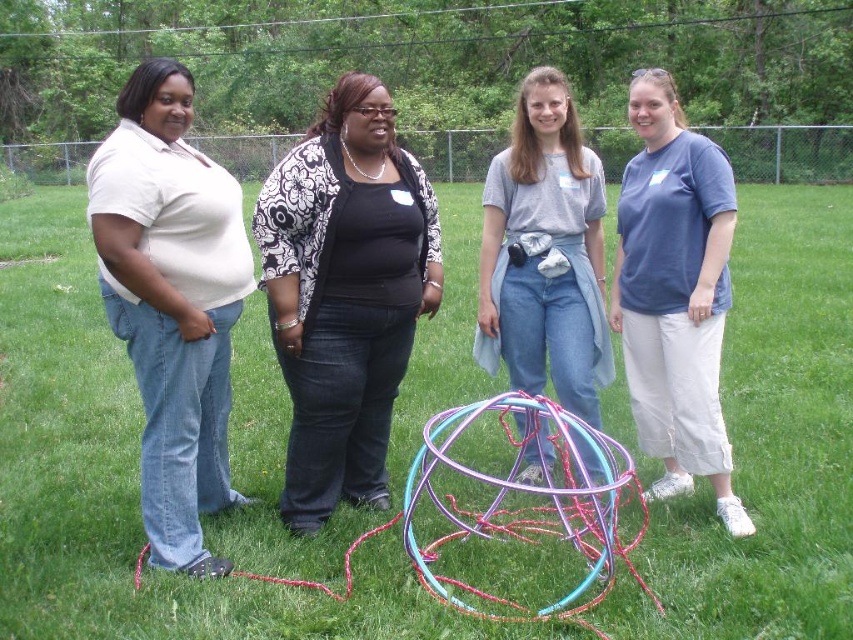
Question: Among these objects, which one is nearest to the camera?

Choices:
 (A) black matte/black textured shirt at center
 (B) blue cotton shirt at right

Answer: (A)

Question: Is blue cotton shirt at right in front of gray cotton shirt at center?

Choices:
 (A) no
 (B) yes

Answer: (B)

Question: Which point is closer to the camera?

Choices:
 (A) blue cotton shirt at right
 (B) metallic wire ball at center
 (C) gray cotton shirt at center
 (D) black matte/black textured shirt at center

Answer: (B)

Question: Is metallic wire ball at center to the right of matte white shirt at left from the viewer's perspective?

Choices:
 (A) no
 (B) yes

Answer: (A)

Question: Which point is farther from the camera taking this photo?

Choices:
 (A) (566, 163)
 (B) (291, 326)

Answer: (A)

Question: Is matte white shirt at left positioned before blue cotton shirt at right?

Choices:
 (A) yes
 (B) no

Answer: (A)